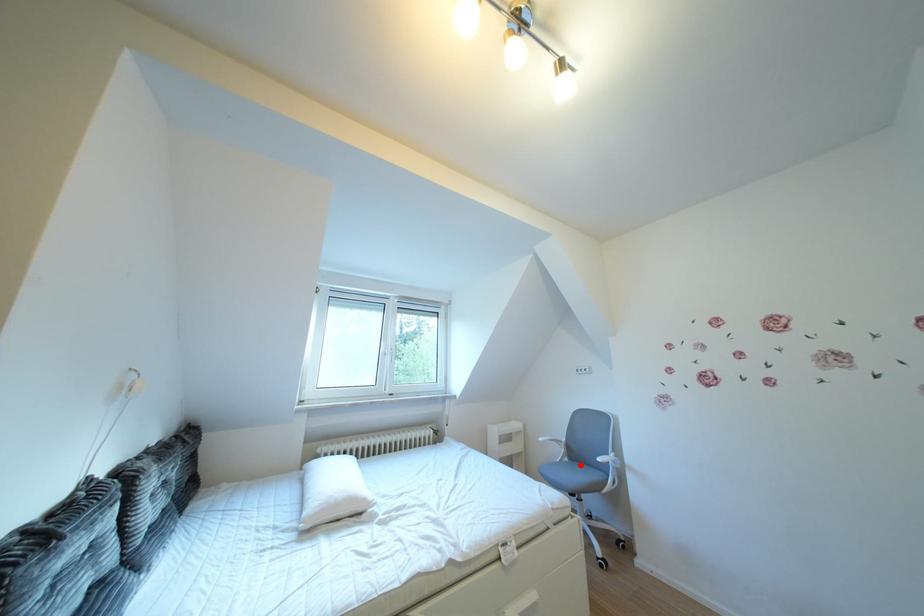
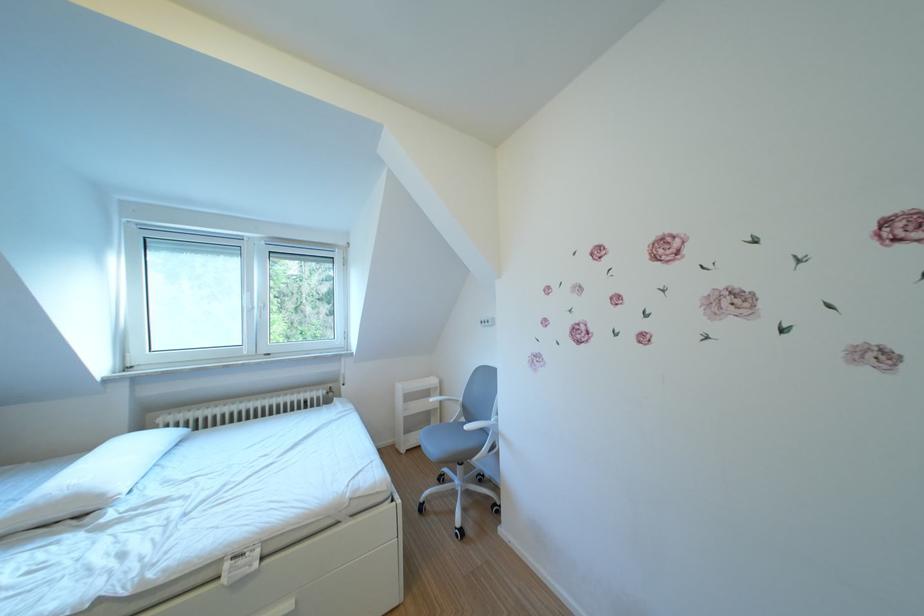
Where in the second image is the point corresponding to the highlighted location from the first image?

(477, 424)